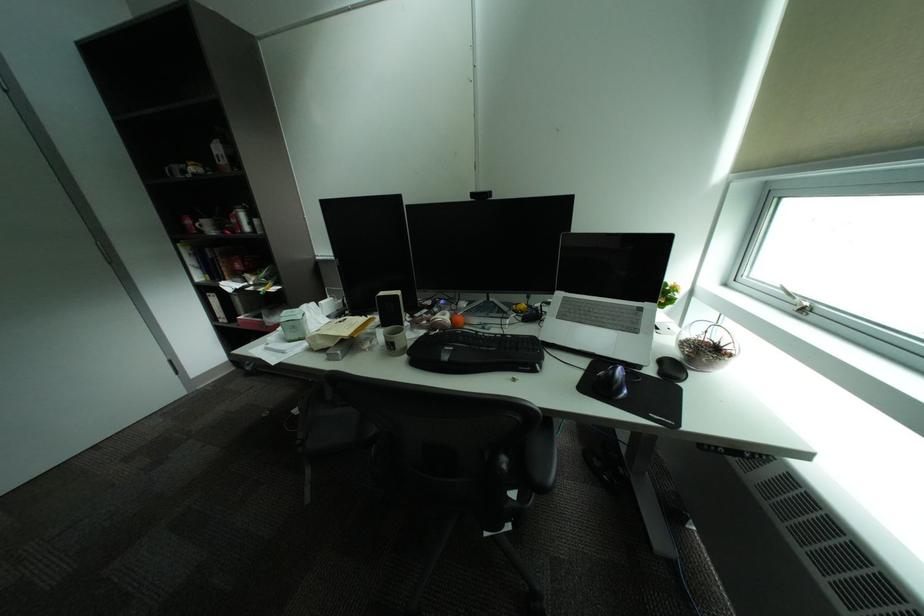
The width and height of the screenshot is (924, 616). Describe the element at coordinates (390, 308) in the screenshot. I see `the black smartphone` at that location.